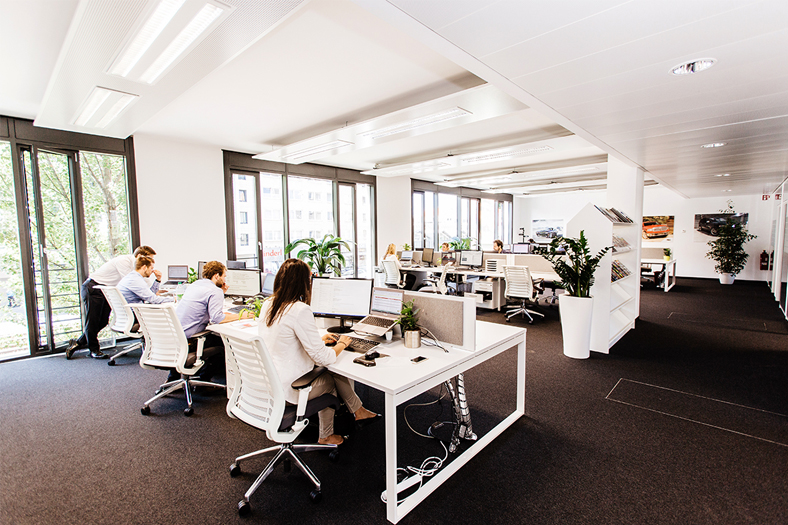
Where is `wires`? wires is located at coordinates pos(440,438), pos(428,401), pos(437,390), pos(426,337).